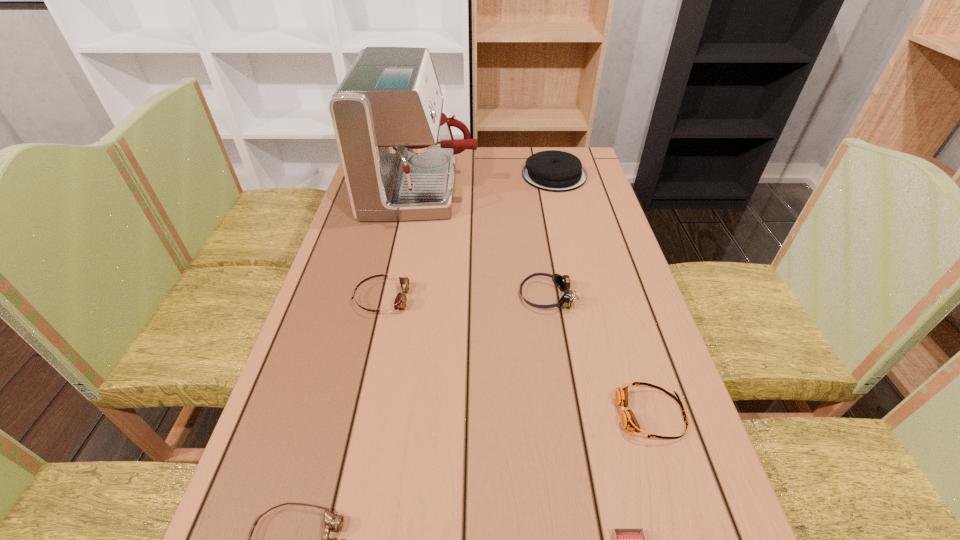
Locate an element on the screen. This screenshot has height=540, width=960. object that is the fifth closest to the second tallest object is located at coordinates (624, 539).

Locate an element on the screen. goggles that is the third closest to the shortest goggles is located at coordinates (562, 282).

Identify which goggles is the nearest to the fifth farthest object. Please provide its 2D coordinates. Your answer should be formatted as a tuple, i.e. [(x, y)], where the tuple contains the x and y coordinates of a point satisfying the conditions above.

[(562, 282)]